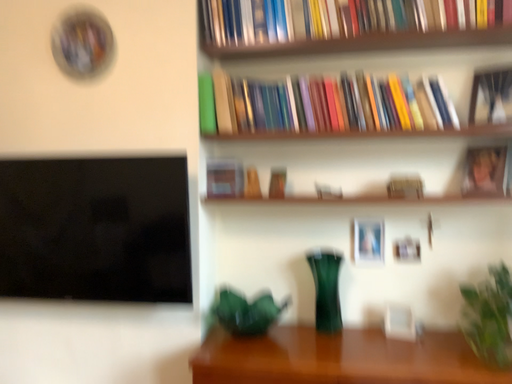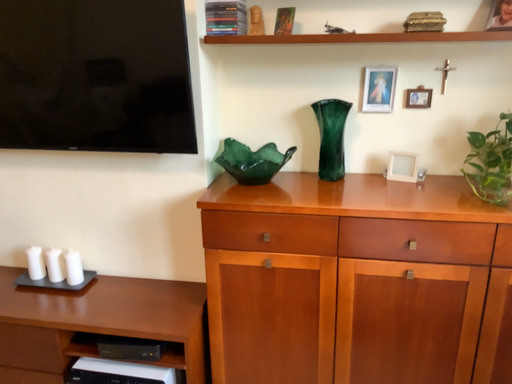
Question: Which way did the camera rotate in the video?

Choices:
 (A) rotated upward
 (B) rotated downward

Answer: (B)